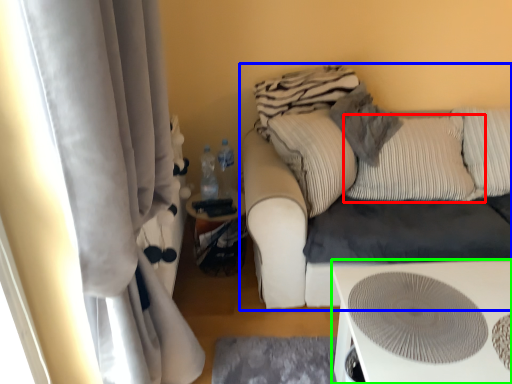
Question: Based on their relative distances, which object is nearer to pillow (highlighted by a red box)? Choose from studio couch (highlighted by a blue box) and table (highlighted by a green box).

Choices:
 (A) studio couch
 (B) table

Answer: (A)